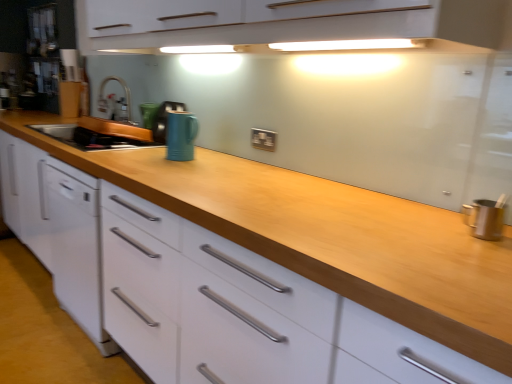
Question: Are satin nickel faucet at center and glossy ceramic mug at center, which appears as the second appliance when viewed from the front, beside each other?

Choices:
 (A) no
 (B) yes

Answer: (A)

Question: Does satin nickel faucet at center have a greater width compared to glossy ceramic mug at center, which is counted as the second appliance, starting from the back?

Choices:
 (A) no
 (B) yes

Answer: (B)

Question: Considering the relative positions of satin nickel faucet at center and glossy ceramic mug at center, which appears as the second appliance when viewed from the front, in the image provided, is satin nickel faucet at center to the right of glossy ceramic mug at center, which appears as the second appliance when viewed from the front, from the viewer's perspective?

Choices:
 (A) yes
 (B) no

Answer: (B)

Question: Is satin nickel faucet at center far away from glossy ceramic mug at center, which appears as the second appliance when viewed from the front?

Choices:
 (A) no
 (B) yes

Answer: (A)

Question: Does satin nickel faucet at center have a larger size compared to glossy ceramic mug at center, which appears as the second appliance when viewed from the front?

Choices:
 (A) no
 (B) yes

Answer: (B)

Question: Is black plastic electric outlet at center spatially inside metallic silver utensil holder at right, or outside of it?

Choices:
 (A) inside
 (B) outside

Answer: (B)

Question: In terms of width, does black plastic electric outlet at center look wider or thinner when compared to metallic silver utensil holder at right?

Choices:
 (A) thin
 (B) wide

Answer: (A)

Question: Relative to metallic silver utensil holder at right, is black plastic electric outlet at center in front or behind?

Choices:
 (A) behind
 (B) front

Answer: (A)

Question: In the image, is black plastic electric outlet at center on the left side or the right side of metallic silver utensil holder at right?

Choices:
 (A) right
 (B) left

Answer: (B)

Question: From a real-world perspective, relative to matte blue mug at center, which is the third appliance in back-to-front order, is glossy ceramic mug at center, which is counted as the second appliance, starting from the back, vertically above or below?

Choices:
 (A) below
 (B) above

Answer: (A)

Question: From the image's perspective, is glossy ceramic mug at center, which is counted as the second appliance, starting from the back, located above or below matte blue mug at center, which is the third appliance in back-to-front order?

Choices:
 (A) above
 (B) below

Answer: (A)

Question: Based on their sizes in the image, would you say glossy ceramic mug at center, which appears as the second appliance when viewed from the front, is bigger or smaller than matte blue mug at center, positioned as the first appliance in front-to-back order?

Choices:
 (A) small
 (B) big

Answer: (B)

Question: Considering the positions of point (164, 117) and point (175, 140), is point (164, 117) closer or farther from the camera than point (175, 140)?

Choices:
 (A) farther
 (B) closer

Answer: (A)

Question: Choose the correct answer: Is matte blue mug at center, positioned as the first appliance in front-to-back order, inside black plastic electric outlet at center or outside it?

Choices:
 (A) inside
 (B) outside

Answer: (B)

Question: From the image's perspective, is matte blue mug at center, positioned as the first appliance in front-to-back order, above or below black plastic electric outlet at center?

Choices:
 (A) below
 (B) above

Answer: (B)